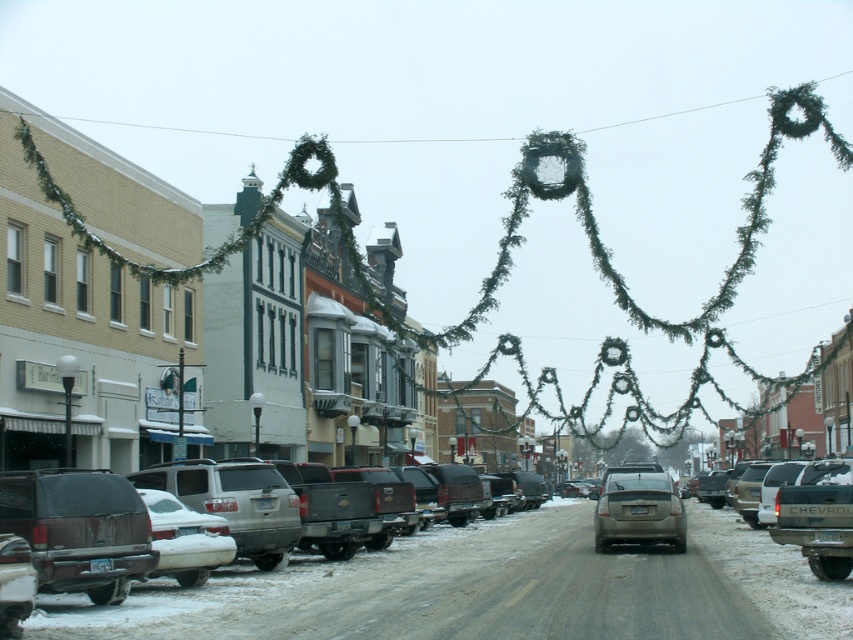
Is dark brown matte suv at left wider than matte gray sedan at center?

Incorrect, dark brown matte suv at left's width does not surpass matte gray sedan at center's.

Where is `dark brown matte suv at left`? The height and width of the screenshot is (640, 853). dark brown matte suv at left is located at coordinates (79, 529).

This screenshot has width=853, height=640. I want to click on dark brown matte suv at left, so click(79, 529).